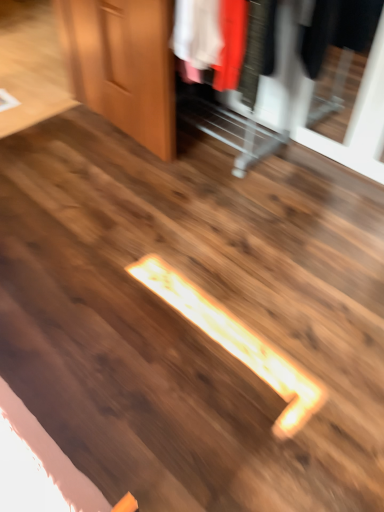
Question: Based on their sizes in the image, would you say wooden dresser at upper right is bigger or smaller than wooden door at upper left?

Choices:
 (A) small
 (B) big

Answer: (B)

Question: Considering the positions of wooden dresser at upper right and wooden door at upper left in the image, is wooden dresser at upper right wider or thinner than wooden door at upper left?

Choices:
 (A) thin
 (B) wide

Answer: (B)

Question: Do you think wooden dresser at upper right is within wooden door at upper left, or outside of it?

Choices:
 (A) outside
 (B) inside

Answer: (A)

Question: Considering the positions of point (71, 41) and point (339, 74), is point (71, 41) closer or farther from the camera than point (339, 74)?

Choices:
 (A) farther
 (B) closer

Answer: (B)

Question: From a real-world perspective, is wooden door at upper left positioned above or below wooden dresser at upper right?

Choices:
 (A) above
 (B) below

Answer: (B)

Question: Choose the correct answer: Is wooden door at upper left inside wooden dresser at upper right or outside it?

Choices:
 (A) inside
 (B) outside

Answer: (B)

Question: Is wooden door at upper left to the left or to the right of wooden dresser at upper right in the image?

Choices:
 (A) right
 (B) left

Answer: (B)